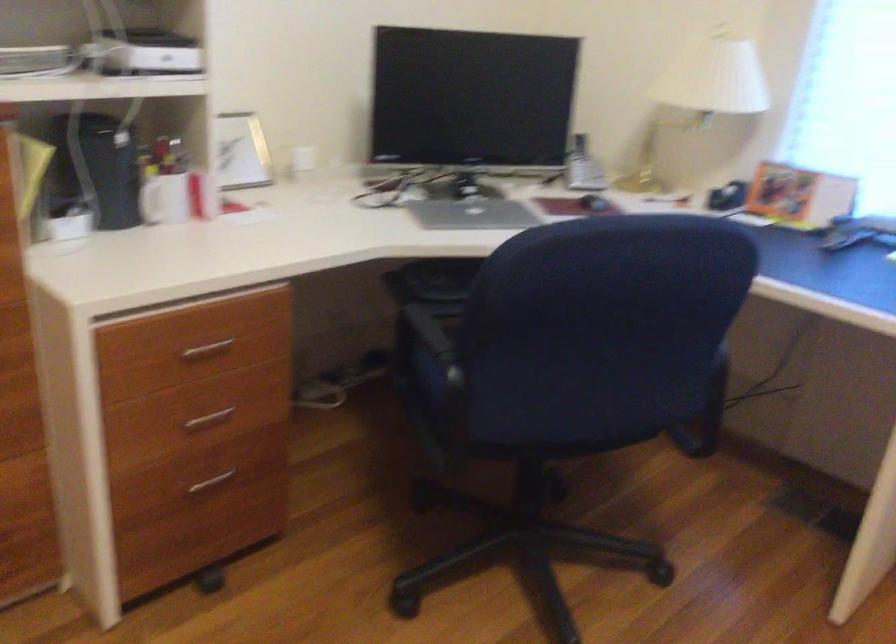
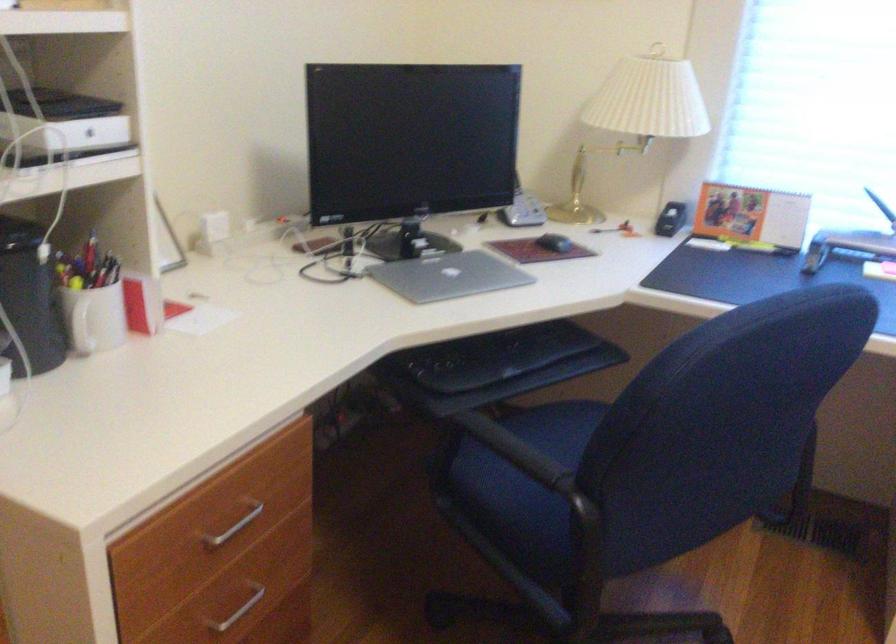
Locate, in the second image, the point that corresponds to [468,212] in the first image.

(449, 276)